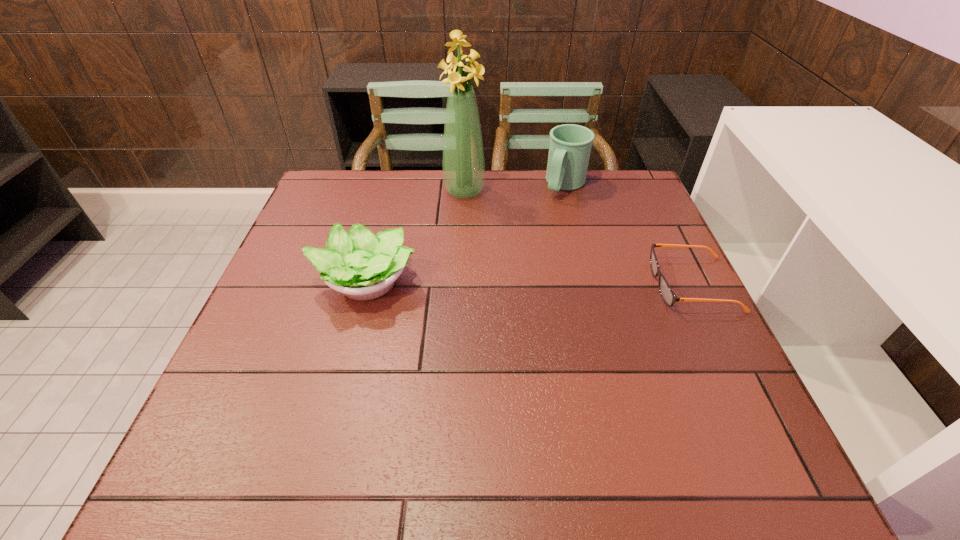
Find the location of a particular element. vacant position in the image that satisfies the following two spatial constraints: 1. on the front side of the mug; 2. on the front-facing side of the spectacles is located at coordinates (590, 285).

Find the location of a particular element. vacant space that satisfies the following two spatial constraints: 1. on the back side of the second shortest object; 2. on the left side of the second object from right to left is located at coordinates [392, 185].

At what (x,y) coordinates should I click in order to perform the action: click on blank space that satisfies the following two spatial constraints: 1. on the back side of the mug; 2. on the right side of the third tallest object. Please return your answer as a coordinate pair (x, y). Looking at the image, I should click on (392, 185).